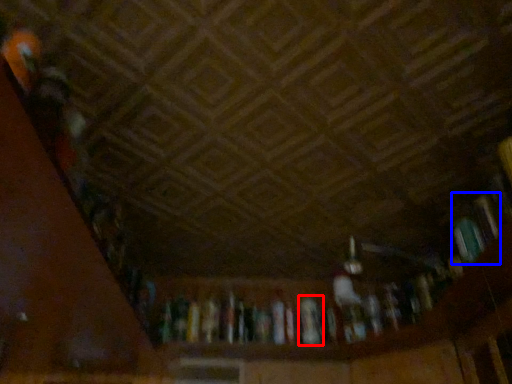
Question: Which of the following is the closest to the observer, book (highlighted by a red box) or book (highlighted by a blue box)?

Choices:
 (A) book
 (B) book

Answer: (B)